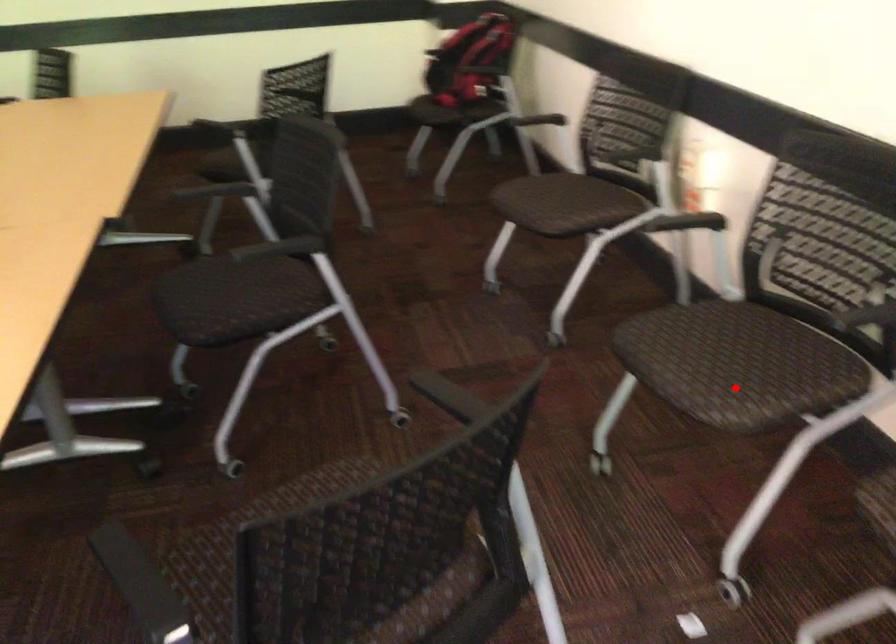
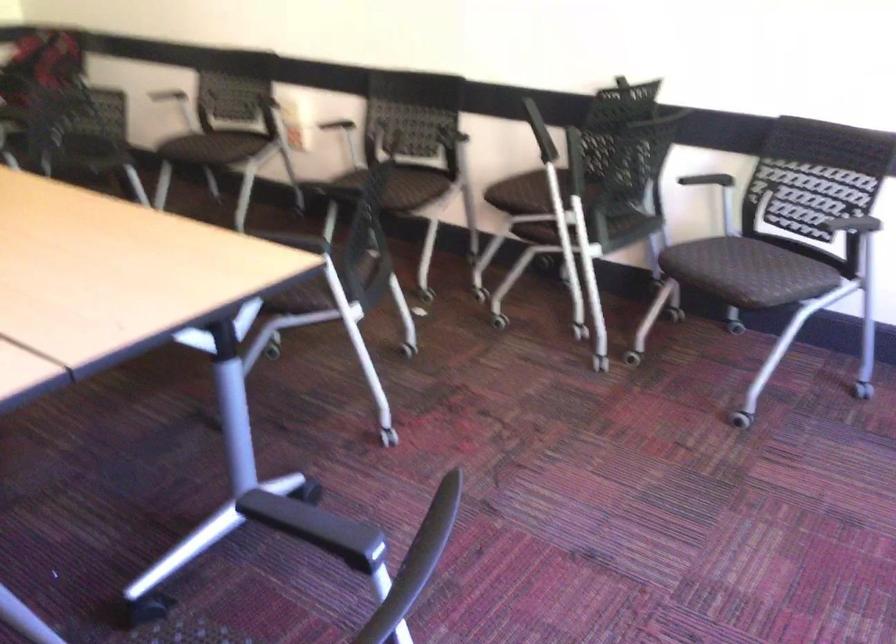
Question: A red point is marked in image1. In image2, is the corresponding 3D point closer to the camera or farther? Reply with the corresponding letter.

Choices:
 (A) The corresponding 3D point is closer.
 (B) The corresponding 3D point is farther.

Answer: (B)